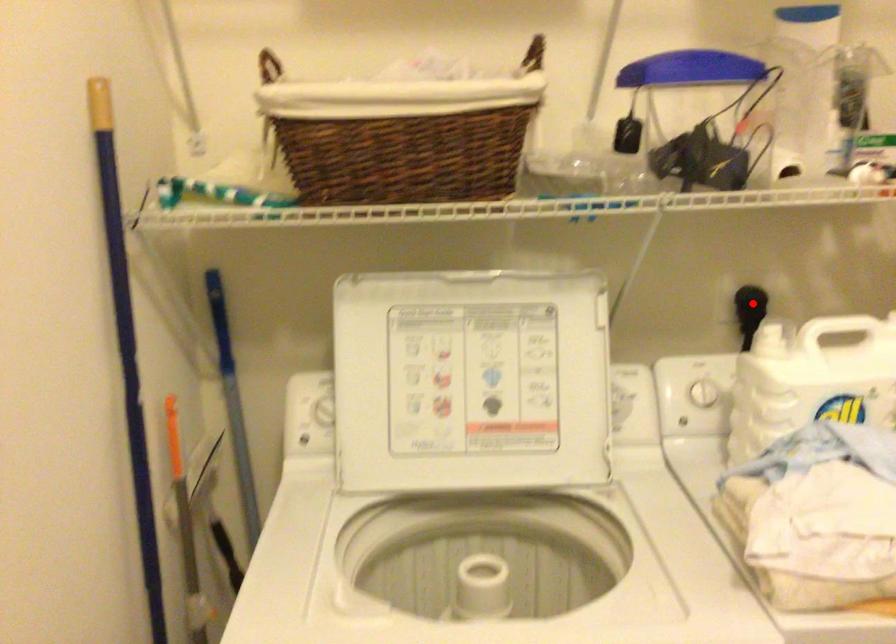
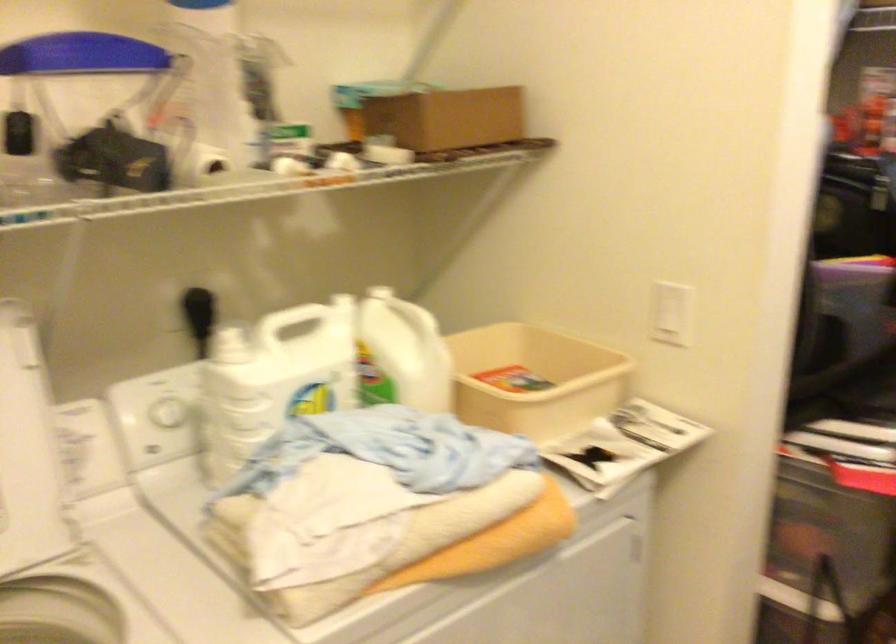
Where in the second image is the point corresponding to the highlighted location from the first image?

(197, 303)